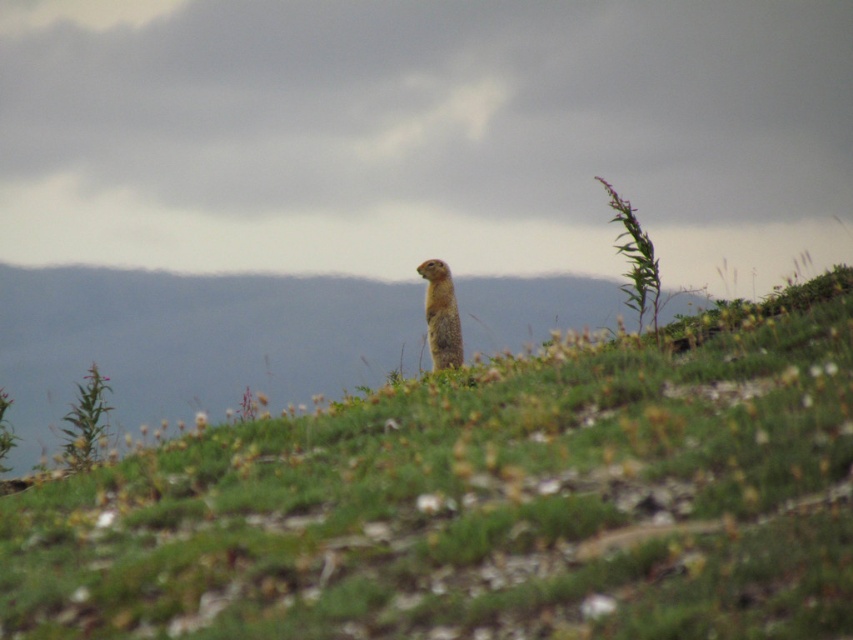
You are standing in the scene and want to walk from point (840, 552) to point (439, 264). Which direction should you move to get closer to your destination?

To move from point (840, 552) to point (439, 264), you should move towards the upper left direction since point (439, 264) is further away from the viewer compared to your starting point.

You are a small insect trying to hide from a predator. You can choose between the green grassy at center and the furry brown squirrel at center. Which location offers better concealment based on their height differences?

The green grassy at center has a lesser height compared to the furry brown squirrel at center, so the squirrel is taller. Therefore, hiding under the green grassy at center would provide better concealment as it is shorter and less visible.

You are observing the scene and want to locate the green grassy area at center. According to the coordinates provided, where exactly is the green grassy at center positioned?

The green grassy at center is positioned at coordinates point [483,500].